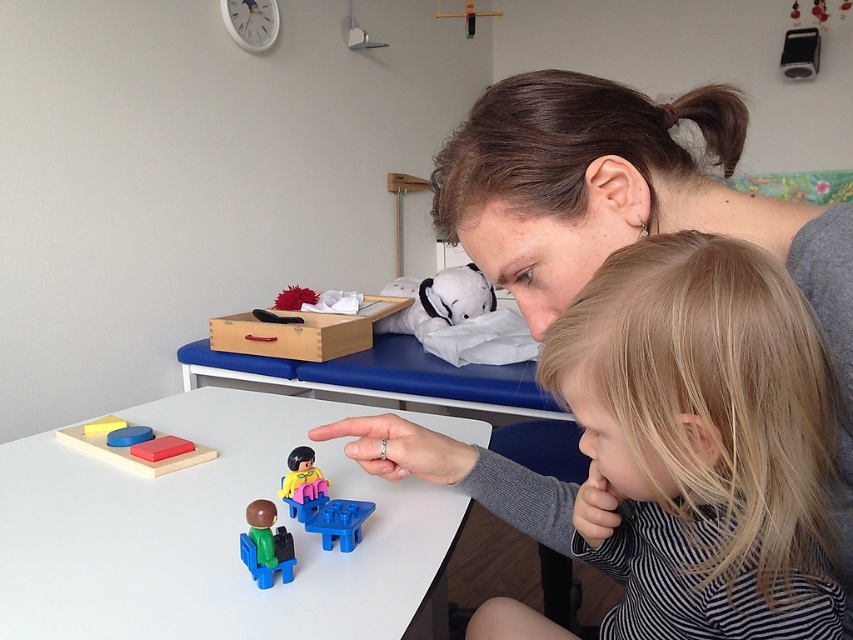
You are a child trying to reach for both the rubber matte block at table and the smooth plastic blocks at center. Which one can you grab first without moving your position?

The rubber matte block at table is closer to the viewer than the smooth plastic blocks at center, so you can grab the rubber matte block at table first without moving your position.

Consider the image. You are a delivery robot that needs to deliver a small package to a point in the room. The package must be placed precisely at point (331, 529). Given that your robotic arm can reach up to 30 inches, can you successfully place the package at that point without moving closer?

The distance of point (331, 529) from the camera is 28.28 inches. Since your robotic arm can reach up to 30 inches, you can successfully place the package at that point without moving closer.

The woman and the young girl are both near the blue plastic table at center. How far apart are they from each other?

They are 28.04 inches apart.